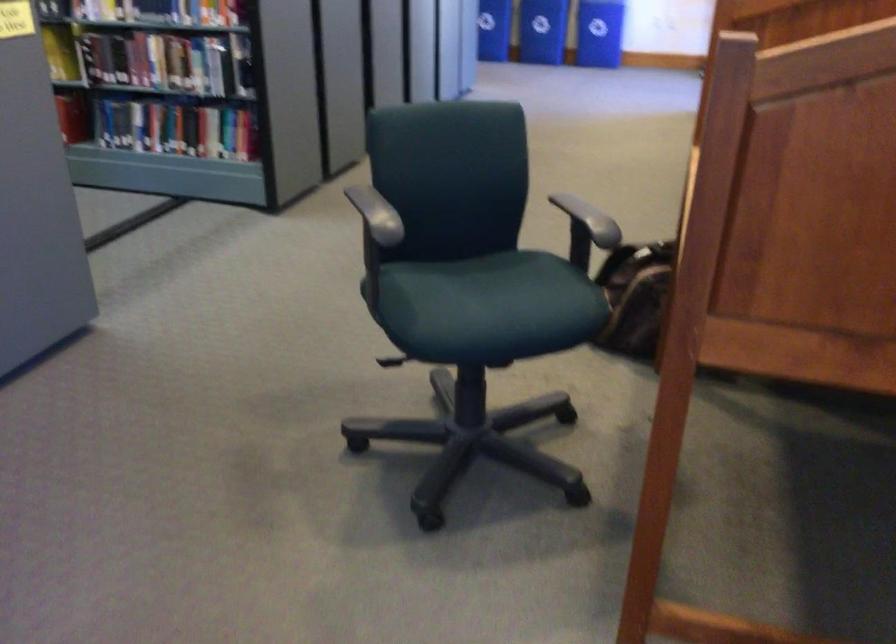
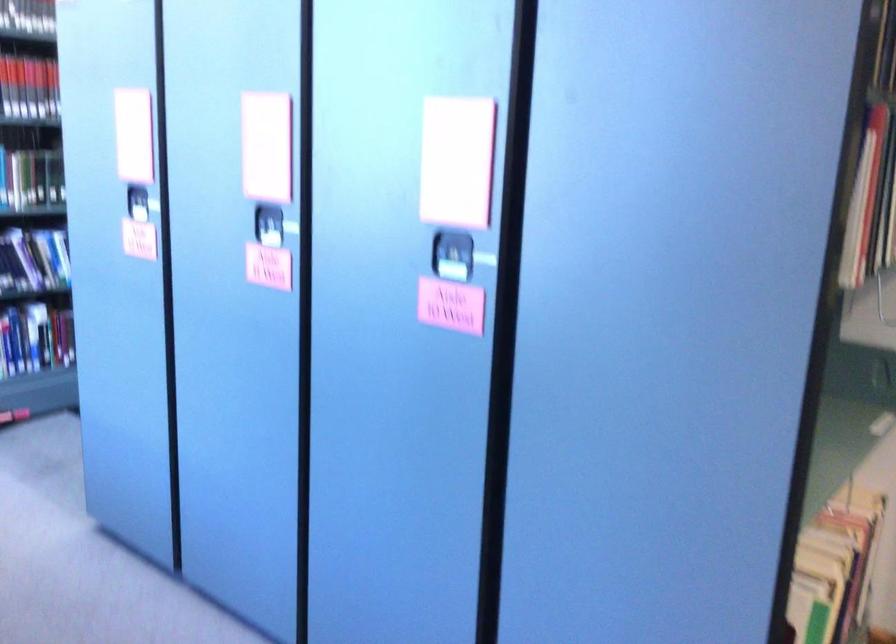
Based on the continuous images, in which direction is the camera rotating?

The camera rotated toward left-down.